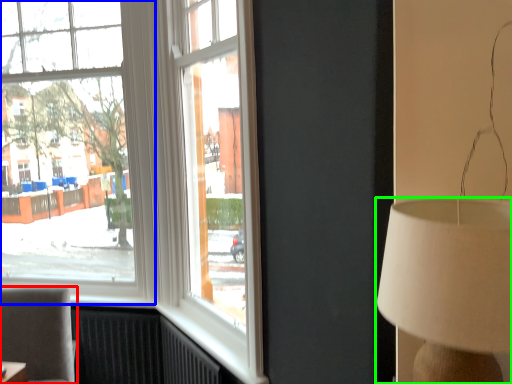
Question: Based on their relative distances, which object is farther from furniture (highlighted by a red box)? Choose from window (highlighted by a blue box) and lamp (highlighted by a green box).

Choices:
 (A) window
 (B) lamp

Answer: (B)